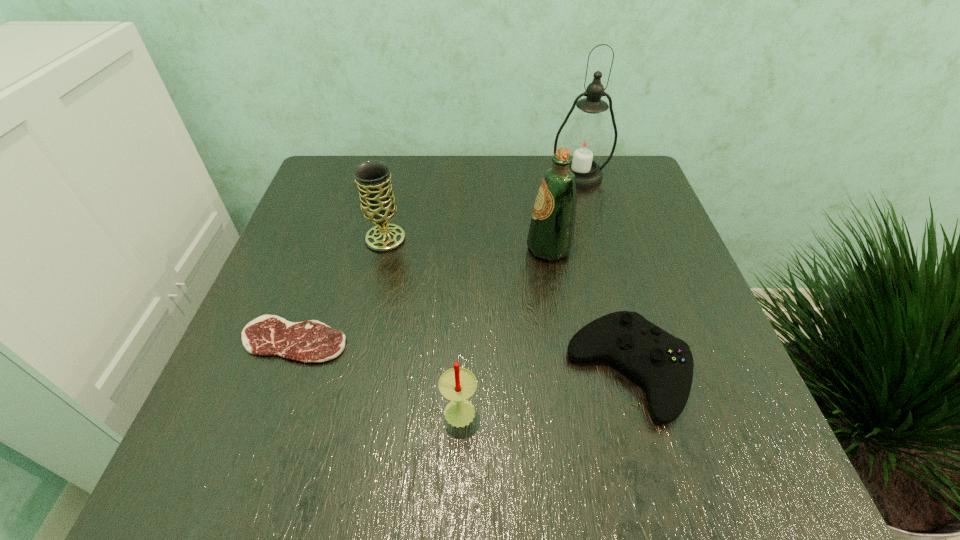
Locate an element on the screen. control that is positioned at the right edge is located at coordinates (663, 363).

Identify the location of object that is at the far right corner. The image size is (960, 540). (x=586, y=139).

At what (x,y) coordinates should I click in order to perform the action: click on vacant point at the far edge. Please return your answer as a coordinate pair (x, y). Looking at the image, I should click on (412, 201).

This screenshot has width=960, height=540. I want to click on free space at the near edge of the desktop, so click(x=513, y=480).

I want to click on vacant space at the left edge of the desktop, so click(297, 251).

The image size is (960, 540). Find the location of `vacant space at the right edge`. vacant space at the right edge is located at coordinates (689, 313).

In the image, there is a desktop. At what (x,y) coordinates should I click in order to perform the action: click on vacant space at the near left corner. Please return your answer as a coordinate pair (x, y). Looking at the image, I should click on (289, 490).

You are a GUI agent. You are given a task and a screenshot of the screen. Output one action in this format:
    pyautogui.click(x=<x>, y=<y>)
    Task: Click on the vacant space at the far right corner of the desktop
    The height and width of the screenshot is (540, 960).
    Given the screenshot: What is the action you would take?
    pyautogui.click(x=607, y=205)

Where is `vacant area between the third shortest object and the fifth tallest object`? vacant area between the third shortest object and the fifth tallest object is located at coordinates (544, 390).

Locate an element on the screen. The image size is (960, 540). free space between the candle and the chalice is located at coordinates (422, 323).